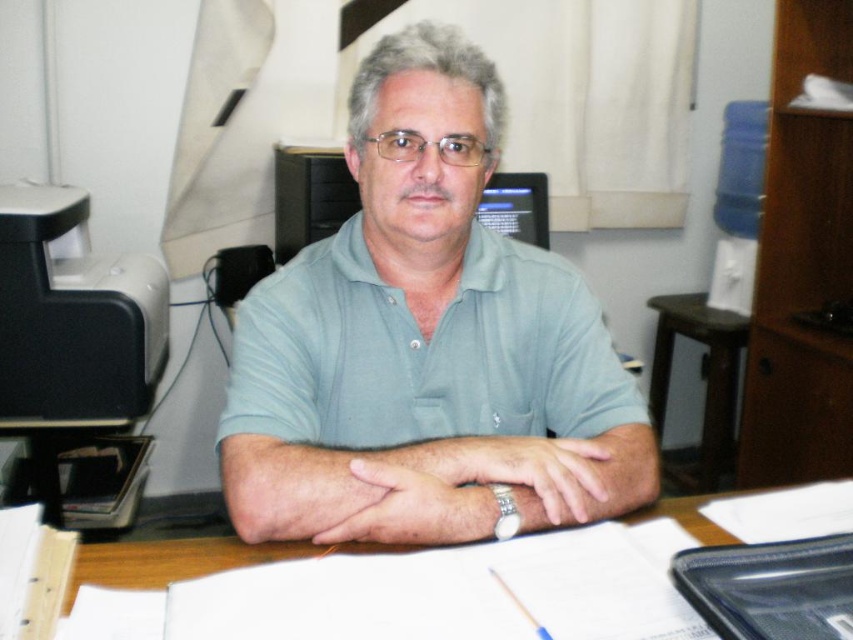
From the picture: You are a photographer standing in front of the scene. You want to take a photo that includes both the light blue cotton shirt at center and the wooden table at right. Which object will appear larger in the photo?

The light blue cotton shirt at center will appear larger in the photo because it is closer to the viewer than the wooden table at right.

You are a customer service representative who needs to locate the light blue cotton shirt at center in the image. The system shows its coordinates as point (426, 344). Can you confirm if this point is within the boundaries of the light blue cotton shirt at center?

The light blue cotton shirt at center is represented by point (426, 344), so yes, the point is exactly at the center of the light blue cotton shirt at center.

You are standing in the office and want to place a new item at the location marked by point (463, 518). However, there is already an object at point (572, 572). Based on their positions, will the new item be placed in front of or behind the existing object?

Point (463, 518) is behind point (572, 572), so the new item will be placed behind the existing object.